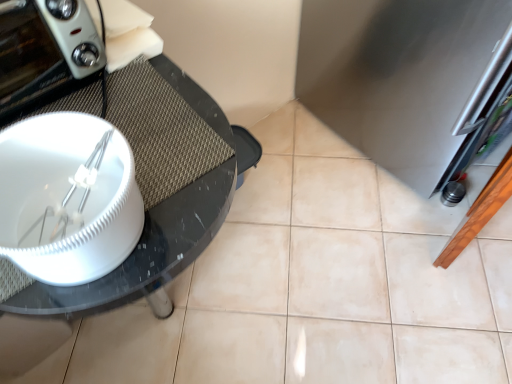
Find the location of a particular element. black glossy glass table at left is located at coordinates (156, 187).

You are a GUI agent. You are given a task and a screenshot of the screen. Output one action in this format:
    pyautogui.click(x=<x>, y=<y>)
    Task: Click on the stainless steel refrigerator at right
    Image resolution: width=512 pixels, height=384 pixels.
    Given the screenshot: What is the action you would take?
    pyautogui.click(x=410, y=81)

Looking at the image, does black glossy glass table at left seem bigger or smaller compared to stainless steel refrigerator at right?

black glossy glass table at left is smaller than stainless steel refrigerator at right.

Does point (98, 97) come in front of point (450, 12)?

Yes.

Does black glossy glass table at left have a lesser height compared to stainless steel refrigerator at right?

Yes.

Which point is more distant from viewer, (x=104, y=283) or (x=88, y=37)?

Point (x=88, y=37)

Identify the location of glass table that appears below the matte white toaster at left (from the image's perspective). (156, 187).

From the image's perspective, between black glossy glass table at left and matte white toaster at left, who is located below?

From the image's view, black glossy glass table at left is below.

Is black glossy glass table at left positioned far away from matte white toaster at left?

black glossy glass table at left is near matte white toaster at left, not far away.

How far apart are matte white toaster at left and black glossy glass table at left?

The distance of matte white toaster at left from black glossy glass table at left is 6.19 inches.

Find the location of `glass table below the matte white toaster at left (from a real-world perspective)`. glass table below the matte white toaster at left (from a real-world perspective) is located at coordinates (156, 187).

From the image's perspective, which is above, matte white toaster at left or black glossy glass table at left?

matte white toaster at left.

In the scene shown: How many degrees apart are the facing directions of matte white toaster at left and black glossy glass table at left?

They differ by 0.321 degrees in their facing directions.

Is point (484, 120) more distant than point (221, 153)?

Yes, it is behind point (221, 153).

From a real-world perspective, who is located higher, stainless steel refrigerator at right or black glossy glass table at left?

black glossy glass table at left.

Is stainless steel refrigerator at right outside of black glossy glass table at left?

That's correct, stainless steel refrigerator at right is outside of black glossy glass table at left.

From the image's perspective, is stainless steel refrigerator at right below black glossy glass table at left?

No.

Does matte white toaster at left turn towards stainless steel refrigerator at right?

No, matte white toaster at left is not aimed at stainless steel refrigerator at right.

From the image's perspective, relative to stainless steel refrigerator at right, is matte white toaster at left above or below?

Based on their image positions, matte white toaster at left is located beneath stainless steel refrigerator at right.

Between point (9, 7) and point (423, 169), which one is positioned behind?

The point (423, 169) is behind.

Where is `home appliance positioned vertically above the stainless steel refrigerator at right (from a real-world perspective)`? The image size is (512, 384). home appliance positioned vertically above the stainless steel refrigerator at right (from a real-world perspective) is located at coordinates (45, 48).

Consider the image. Does stainless steel refrigerator at right appear on the right side of matte white toaster at left?

Yes, stainless steel refrigerator at right is to the right of matte white toaster at left.

Is stainless steel refrigerator at right taller than matte white toaster at left?

Indeed, stainless steel refrigerator at right has a greater height compared to matte white toaster at left.

Consider the image. Is stainless steel refrigerator at right not near matte white toaster at left?

They are positioned close to each other.

Does point (404, 99) come behind point (53, 48)?

Yes.

This screenshot has height=384, width=512. Find the location of `glass table to the left of stainless steel refrigerator at right`. glass table to the left of stainless steel refrigerator at right is located at coordinates (156, 187).

Find the location of a particular element. This screenshot has width=512, height=384. home appliance above the black glossy glass table at left (from the image's perspective) is located at coordinates click(45, 48).

Looking at the image, which one is located further to matte white toaster at left, stainless steel refrigerator at right or black glossy glass table at left?

stainless steel refrigerator at right is further to matte white toaster at left.

Looking at this image, considering their positions, is matte white toaster at left positioned further to black glossy glass table at left than stainless steel refrigerator at right?

stainless steel refrigerator at right is further to black glossy glass table at left.

Considering their positions, is black glossy glass table at left positioned further to stainless steel refrigerator at right than matte white toaster at left?

matte white toaster at left is positioned further to the anchor stainless steel refrigerator at right.

Considering their positions, is stainless steel refrigerator at right positioned further to black glossy glass table at left than matte white toaster at left?

stainless steel refrigerator at right is further to black glossy glass table at left.

Based on their spatial positions, is matte white toaster at left or black glossy glass table at left further from stainless steel refrigerator at right?

matte white toaster at left is further to stainless steel refrigerator at right.

Looking at this image, estimate the real-world distances between objects in this image. Which object is further from matte white toaster at left, black glossy glass table at left or stainless steel refrigerator at right?

The object further to matte white toaster at left is stainless steel refrigerator at right.

This screenshot has height=384, width=512. What are the coordinates of `glass table located between matte white toaster at left and stainless steel refrigerator at right in the left-right direction` in the screenshot? It's located at (156, 187).